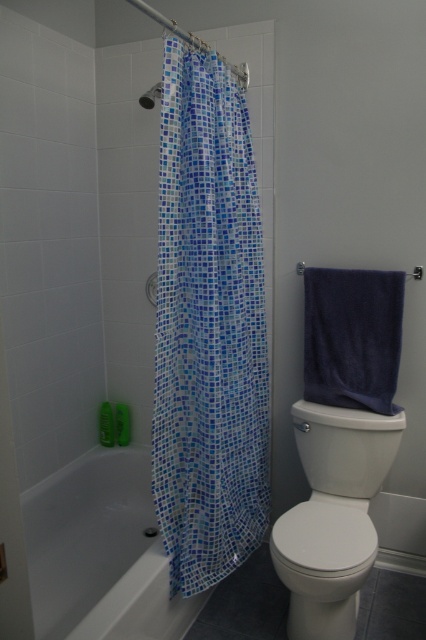
You are a home inspector assessing the bathroom layout. You need to determine if the white glossy toilet at lower right can be replaced with a smaller model without affecting the placement of the matte plastic shower head at upper left. Based on the size difference between them, what would you advise?

The white glossy toilet at lower right is larger than the matte plastic shower head at upper left. Since the toilet is larger, replacing it with a smaller model would free up space, but you must ensure the new toilet fits within the existing plumbing and floor plan to avoid interfering with the shower head.

You are a bathroom designer planning to place a new rectangular shelf between the white glossy toilet at lower right and the matte plastic shower head at upper left. Which object should the shelf be placed closer to if the shelf needs to accommodate items wider than the shower head but narrower than the toilet?

The shelf should be placed closer to the matte plastic shower head at upper left because the white glossy toilet at lower right might be wider than the shower head. This ensures the shelf can accommodate items narrower than the toilet but wider than the shower head.

You are moving a new bathroom accessory that is 1 meter in length. You need to place it somewhere in the bathroom. Considering the blue mosaic fabric shower curtain at left and the white glossy toilet at lower right, which object can accommodate the accessory based on their sizes?

The blue mosaic fabric shower curtain at left is bigger than the white glossy toilet at lower right, so the accessory can be placed near the blue mosaic fabric shower curtain at left as it has more space.